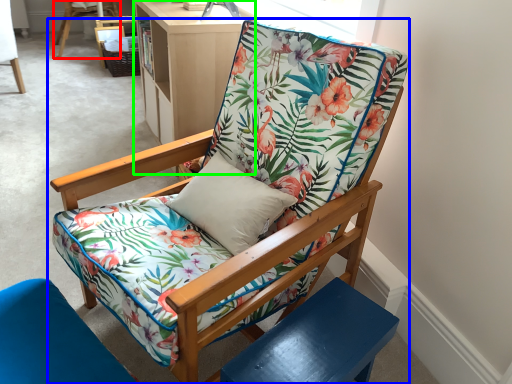
Question: Considering the real-world distances, which object is closest to chair (highlighted by a red box)? chair (highlighted by a blue box) or bookshelf (highlighted by a green box).

Choices:
 (A) chair
 (B) bookshelf

Answer: (B)